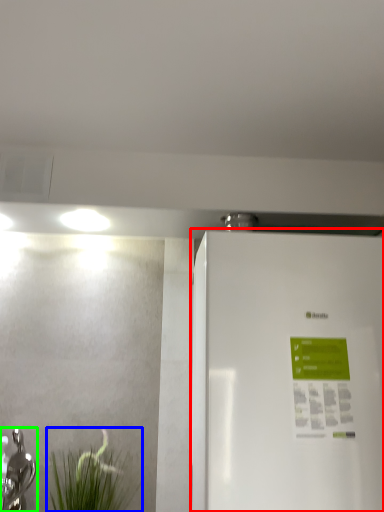
Question: Based on their relative distances, which object is nearer to refrigerator (highlighted by a red box)? Choose from plant (highlighted by a blue box) and tap (highlighted by a green box).

Choices:
 (A) plant
 (B) tap

Answer: (A)